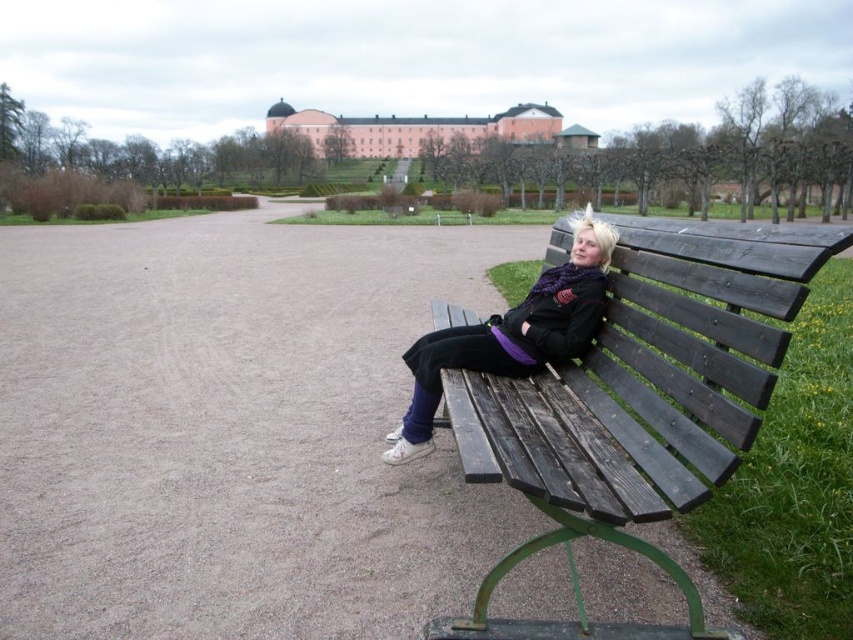
Question: Which point appears farthest from the camera in this image?

Choices:
 (A) 463,312
 (B) 334,497

Answer: (A)

Question: Which object is farther from the camera taking this photo?

Choices:
 (A) matte black jacket at center
 (B) dark wood bench at right
 (C) brown wooden bench at right

Answer: (A)

Question: Can you confirm if dark wood bench at right is bigger than brown wooden bench at right?

Choices:
 (A) no
 (B) yes

Answer: (A)

Question: Is brown wooden bench at right wider than matte black jacket at center?

Choices:
 (A) yes
 (B) no

Answer: (A)

Question: Which point is farther from the camera taking this photo?

Choices:
 (A) (173, 241)
 (B) (680, 220)
 (C) (419, 449)

Answer: (A)

Question: Is brown wooden bench at right further to the viewer compared to matte black jacket at center?

Choices:
 (A) no
 (B) yes

Answer: (A)